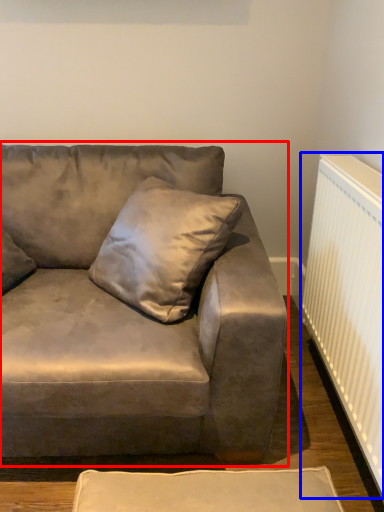
Question: Which point is closer to the camera, studio couch (highlighted by a red box) or radiator (highlighted by a blue box)?

Choices:
 (A) studio couch
 (B) radiator

Answer: (A)